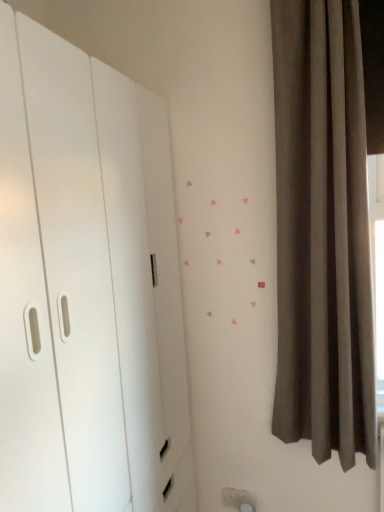
Question: Looking at the image, does white matte dresser at left seem bigger or smaller compared to dark gray velvet curtain at right?

Choices:
 (A) small
 (B) big

Answer: (B)

Question: Relative to dark gray velvet curtain at right, is white matte dresser at left in front or behind?

Choices:
 (A) behind
 (B) front

Answer: (B)

Question: Choose the correct answer: Is white matte dresser at left inside dark gray velvet curtain at right or outside it?

Choices:
 (A) inside
 (B) outside

Answer: (B)

Question: From their relative heights in the image, would you say dark gray velvet curtain at right is taller or shorter than white matte dresser at left?

Choices:
 (A) tall
 (B) short

Answer: (B)

Question: From a real-world perspective, is dark gray velvet curtain at right physically located above or below white matte dresser at left?

Choices:
 (A) below
 (B) above

Answer: (B)

Question: From the image's perspective, is dark gray velvet curtain at right above or below white matte dresser at left?

Choices:
 (A) below
 (B) above

Answer: (B)

Question: In terms of width, does dark gray velvet curtain at right look wider or thinner when compared to white matte dresser at left?

Choices:
 (A) wide
 (B) thin

Answer: (B)